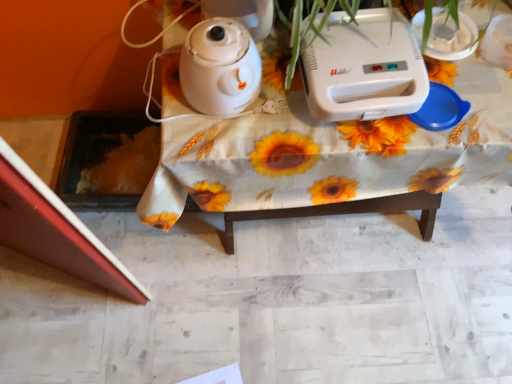
Identify the location of vacant area on top of white plastic toaster at upper center (from a real-world perspective). This screenshot has height=384, width=512. (360, 47).